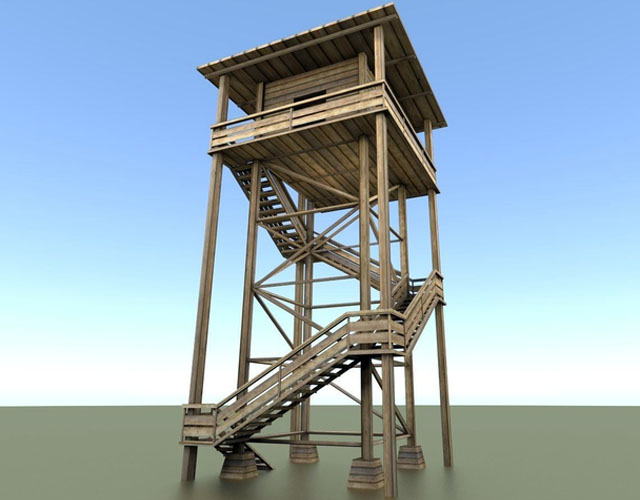
I want to click on diagonal beams, so click(x=335, y=387), click(x=278, y=327), click(x=291, y=311), click(x=312, y=252), click(x=326, y=222), click(x=381, y=216), click(x=330, y=185).